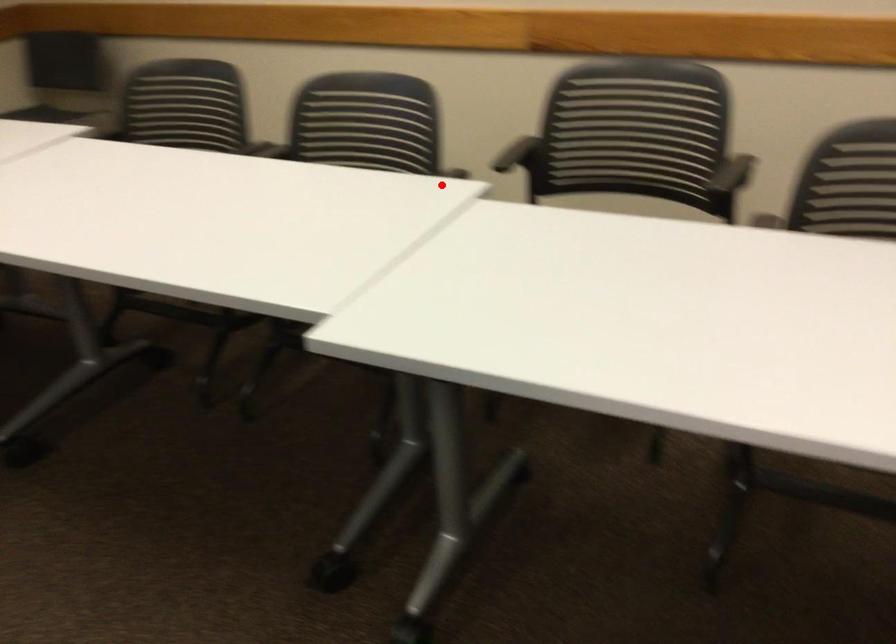
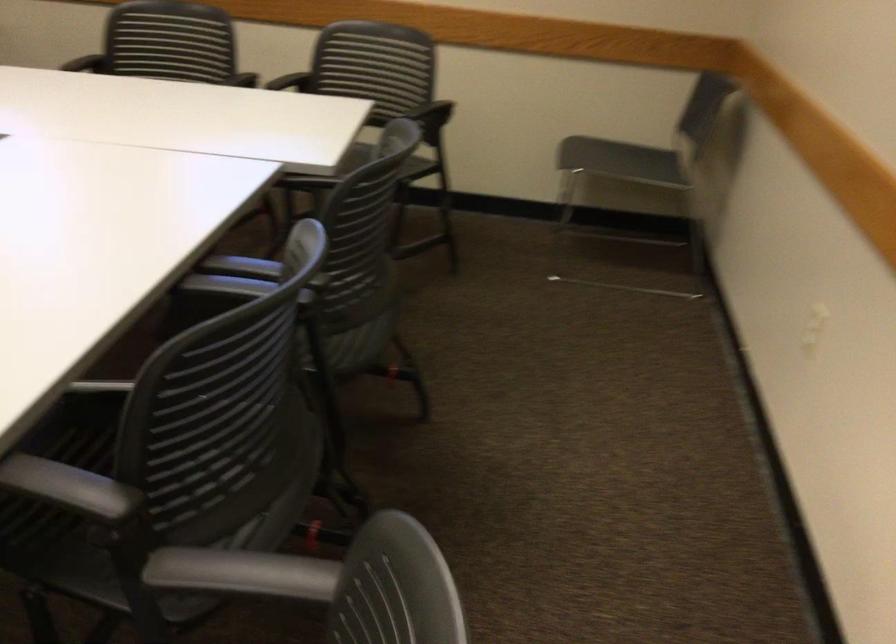
The point at the highlighted location is marked in the first image. Where is the corresponding point in the second image?

(71, 488)